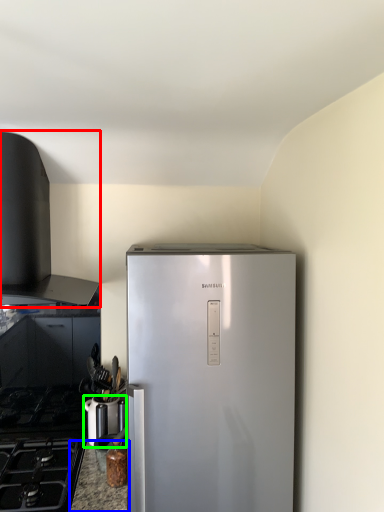
Question: Based on their relative distances, which object is nearer to vent (highlighted by a red box)? Choose from counter top (highlighted by a blue box) and appliance (highlighted by a green box).

Choices:
 (A) counter top
 (B) appliance

Answer: (B)